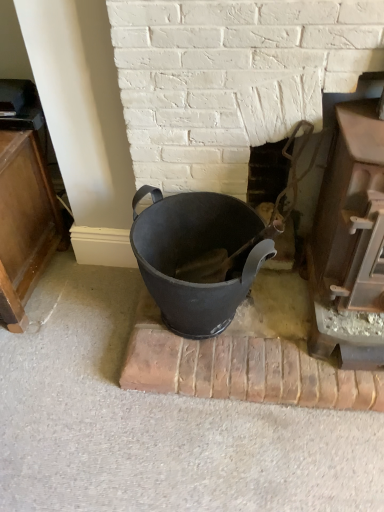
Where is `vacant space in between matte black bucket at center and smooth metal fireplace at center, marked as the second fireplace in a left-to-right arrangement`? The height and width of the screenshot is (512, 384). vacant space in between matte black bucket at center and smooth metal fireplace at center, marked as the second fireplace in a left-to-right arrangement is located at coordinates (284, 320).